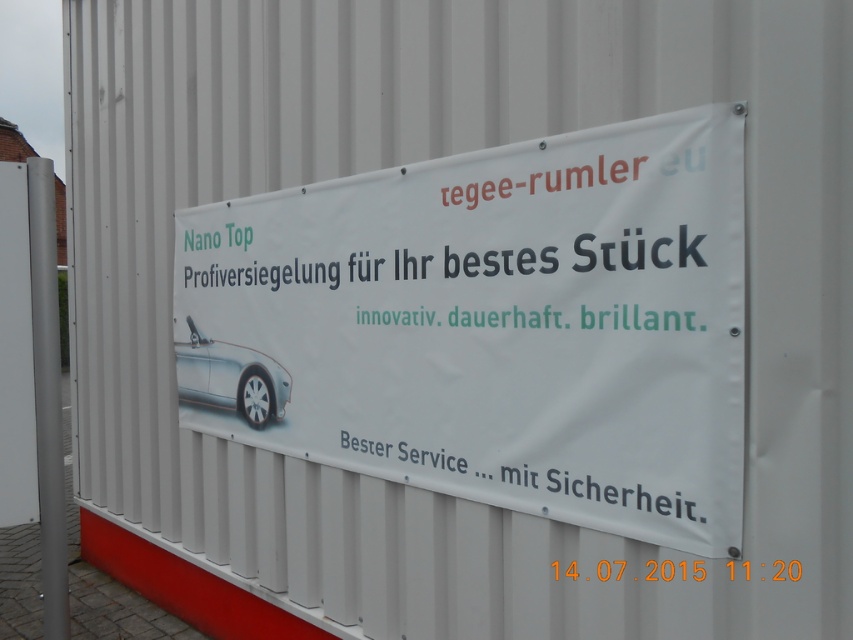
Locate an element on the screen. white matte banner at center is located at coordinates (492, 324).

Which is below, white matte banner at center or silver metallic car at center?

silver metallic car at center is lower down.

This screenshot has height=640, width=853. What are the coordinates of `white matte banner at center` in the screenshot? It's located at (492, 324).

Where is `white matte banner at center`? The width and height of the screenshot is (853, 640). white matte banner at center is located at coordinates (492, 324).